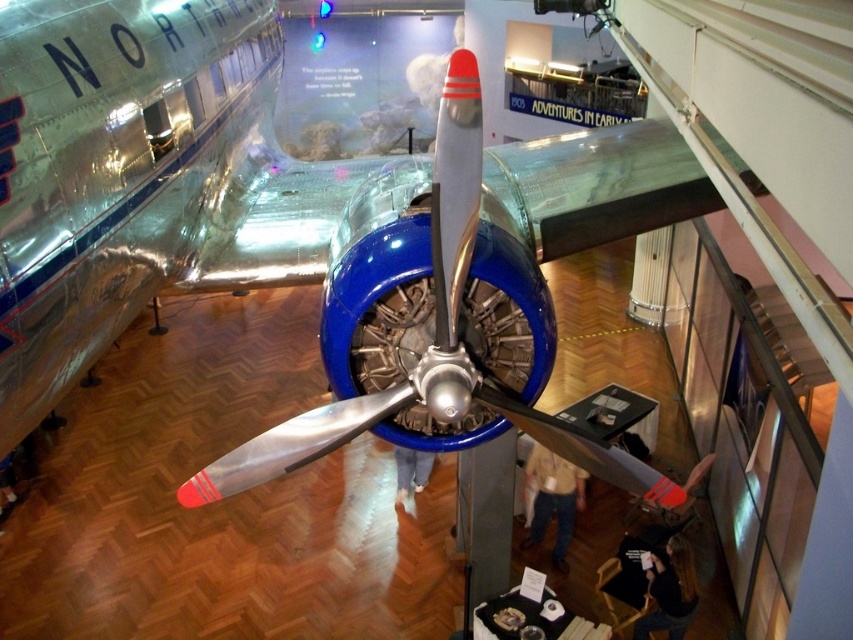
Question: Based on their relative distances, which object is nearer to the polished aluminum airplane at center?

Choices:
 (A) light brown leather jacket at center
 (B) denim pants at center
 (C) dark brown leather jacket at lower right

Answer: (A)

Question: Which object is closer to the camera taking this photo?

Choices:
 (A) denim pants at center
 (B) polished aluminum airplane at center
 (C) dark brown leather jacket at lower right

Answer: (B)

Question: Does dark brown leather jacket at lower right appear on the right side of denim pants at center?

Choices:
 (A) yes
 (B) no

Answer: (A)

Question: Is dark brown leather jacket at lower right to the left of denim pants at center from the viewer's perspective?

Choices:
 (A) yes
 (B) no

Answer: (B)

Question: Can you confirm if polished aluminum airplane at center is positioned below dark brown leather jacket at lower right?

Choices:
 (A) yes
 (B) no

Answer: (B)

Question: Which point appears farthest from the camera in this image?

Choices:
 (A) (677, 586)
 (B) (581, 481)
 (C) (318, 273)
 (D) (398, 497)

Answer: (D)